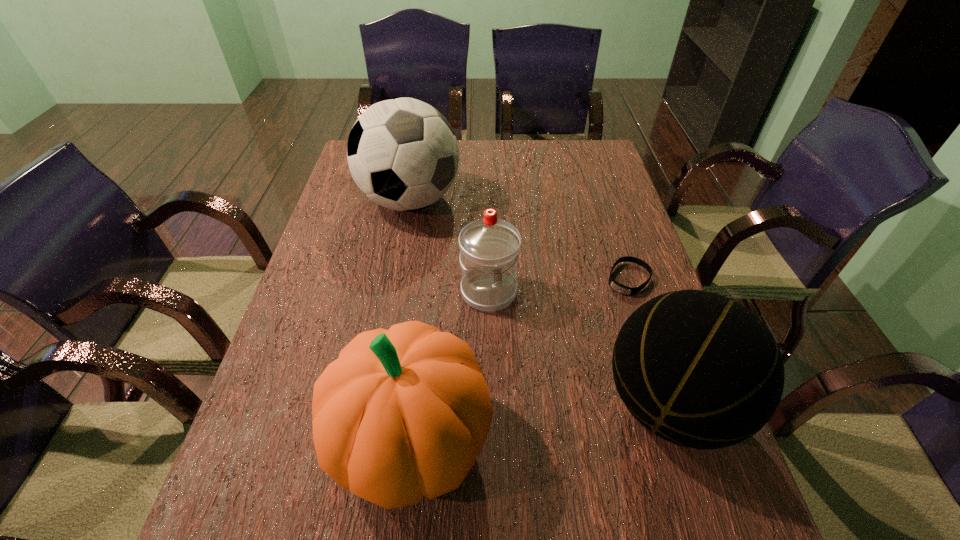
The image size is (960, 540). In order to click on vacant space at the near right corner of the desktop in this screenshot , I will do `click(684, 474)`.

You are a GUI agent. You are given a task and a screenshot of the screen. Output one action in this format:
    pyautogui.click(x=<x>, y=<y>)
    Task: Click on the free point between the soccer ball and the pumpkin
    The image size is (960, 540).
    Given the screenshot: What is the action you would take?
    pyautogui.click(x=411, y=320)

Image resolution: width=960 pixels, height=540 pixels. What are the coordinates of `free spot between the soccer ball and the water bottle` in the screenshot? It's located at (449, 246).

Where is `free space between the basketball and the farthest object`? free space between the basketball and the farthest object is located at coordinates (540, 302).

Where is `free space between the farthest object and the water bottle`? free space between the farthest object and the water bottle is located at coordinates (449, 246).

At what (x,y) coordinates should I click in order to perform the action: click on free spot between the pumpkin and the farthest object. Please return your answer as a coordinate pair (x, y). This screenshot has height=540, width=960. Looking at the image, I should click on (411, 320).

The width and height of the screenshot is (960, 540). In order to click on free space that is in between the farthest object and the pumpkin in this screenshot , I will do `click(411, 320)`.

Locate an element on the screen. Image resolution: width=960 pixels, height=540 pixels. free spot between the pumpkin and the basketball is located at coordinates (540, 422).

Image resolution: width=960 pixels, height=540 pixels. I want to click on unoccupied position between the basketball and the pumpkin, so click(x=540, y=422).

Select which object is the second closest to the pumpkin. Please provide its 2D coordinates. Your answer should be formatted as a tuple, i.e. [(x, y)], where the tuple contains the x and y coordinates of a point satisfying the conditions above.

[(701, 371)]